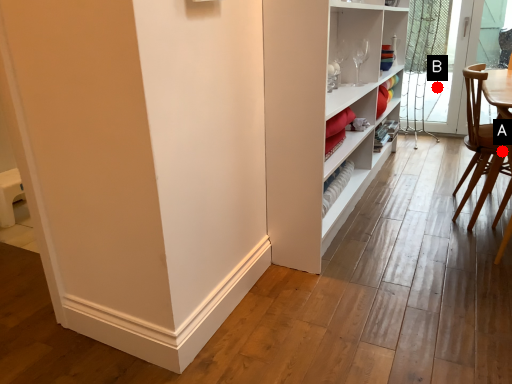
Question: Two points are circled on the image, labeled by A and B beside each circle. Which point is further to the camera?

Choices:
 (A) A is further
 (B) B is further

Answer: (B)